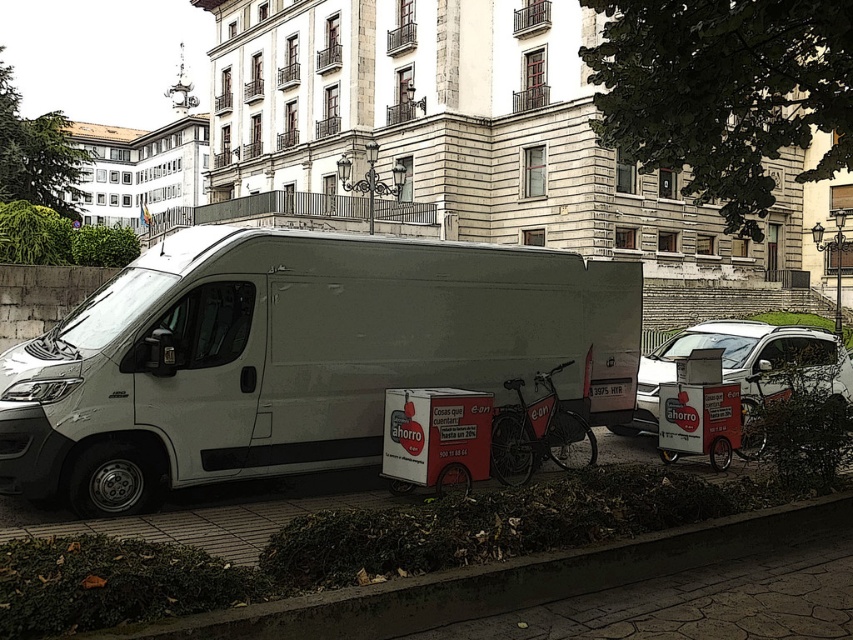
Is white matte van at center smaller than concrete at lower left?

Correct, white matte van at center occupies less space than concrete at lower left.

Can you confirm if white matte van at center is bigger than concrete at lower left?

Incorrect, white matte van at center is not larger than concrete at lower left.

Where is `white matte van at center`? The height and width of the screenshot is (640, 853). white matte van at center is located at coordinates (294, 356).

Does metallic red cooler at center have a lesser height compared to red matte bicycle at center?

Yes, metallic red cooler at center is shorter than red matte bicycle at center.

Consider the image. Is the position of metallic red cooler at center more distant than that of red matte bicycle at center?

No.

Does point (409, 486) lie behind point (569, 444)?

No, (409, 486) is closer to viewer.

Locate an element on the screen. metallic red cooler at center is located at coordinates (434, 436).

Which is more to the left, concrete at lower left or white matte car at center?

concrete at lower left

Based on the photo, does concrete at lower left have a greater width compared to white matte car at center?

Yes.

Is point (395, 584) in front of point (839, 388)?

Yes, point (395, 584) is in front of point (839, 388).

Image resolution: width=853 pixels, height=640 pixels. In order to click on concrete at lower left in this screenshot , I will do `click(511, 580)`.